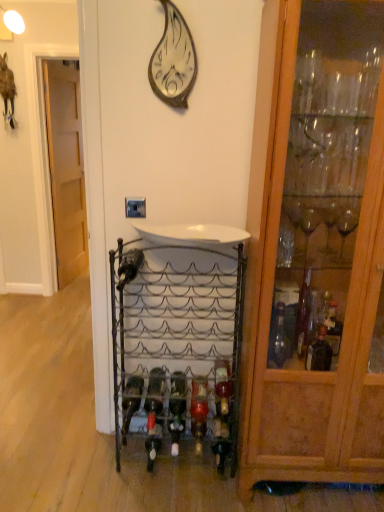
Question: Can you confirm if metallic silver wall clock at upper center is positioned to the left of metallic wine rack at center?

Choices:
 (A) yes
 (B) no

Answer: (A)

Question: Is metallic silver wall clock at upper center bigger than metallic wine rack at center?

Choices:
 (A) no
 (B) yes

Answer: (A)

Question: Is metallic silver wall clock at upper center thinner than metallic wine rack at center?

Choices:
 (A) no
 (B) yes

Answer: (B)

Question: From the image's perspective, would you say metallic silver wall clock at upper center is shown under metallic wine rack at center?

Choices:
 (A) yes
 (B) no

Answer: (B)

Question: Are metallic silver wall clock at upper center and metallic wine rack at center located far from each other?

Choices:
 (A) yes
 (B) no

Answer: (A)

Question: From the image's perspective, is metallic silver wall clock at upper center on metallic wine rack at center?

Choices:
 (A) yes
 (B) no

Answer: (A)

Question: Is wooden cabinet at right thinner than metallic silver wall clock at upper center?

Choices:
 (A) no
 (B) yes

Answer: (A)

Question: Is the position of wooden cabinet at right less distant than that of metallic silver wall clock at upper center?

Choices:
 (A) no
 (B) yes

Answer: (B)

Question: Is wooden cabinet at right not close to metallic silver wall clock at upper center?

Choices:
 (A) no
 (B) yes

Answer: (A)

Question: Is metallic silver wall clock at upper center completely or partially inside wooden cabinet at right?

Choices:
 (A) no
 (B) yes

Answer: (A)

Question: Is wooden cabinet at right touching metallic silver wall clock at upper center?

Choices:
 (A) yes
 (B) no

Answer: (B)

Question: Considering the relative sizes of wooden cabinet at right and metallic silver wall clock at upper center in the image provided, is wooden cabinet at right smaller than metallic silver wall clock at upper center?

Choices:
 (A) no
 (B) yes

Answer: (A)

Question: Can you confirm if metallic wine rack at center is taller than light brown wood door at left?

Choices:
 (A) yes
 (B) no

Answer: (B)